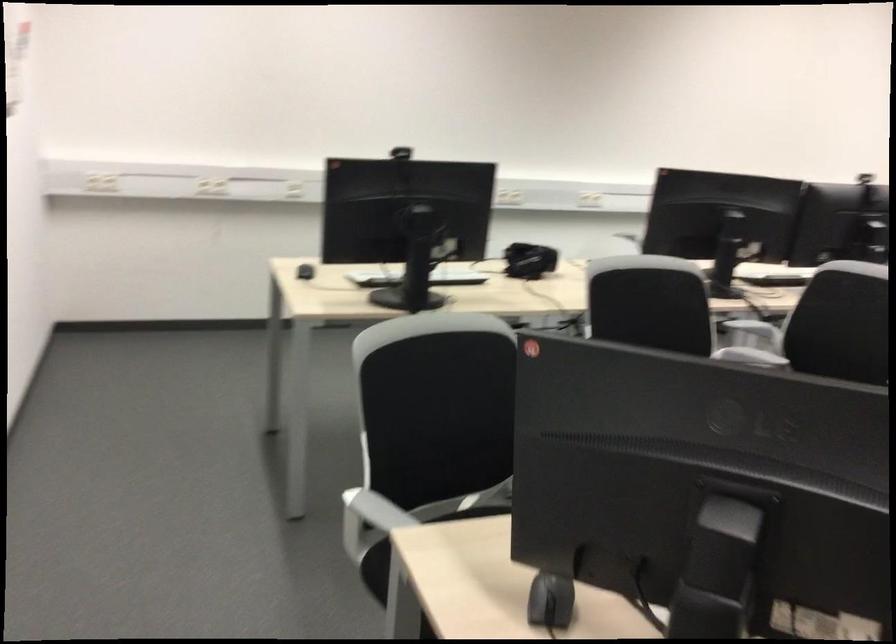
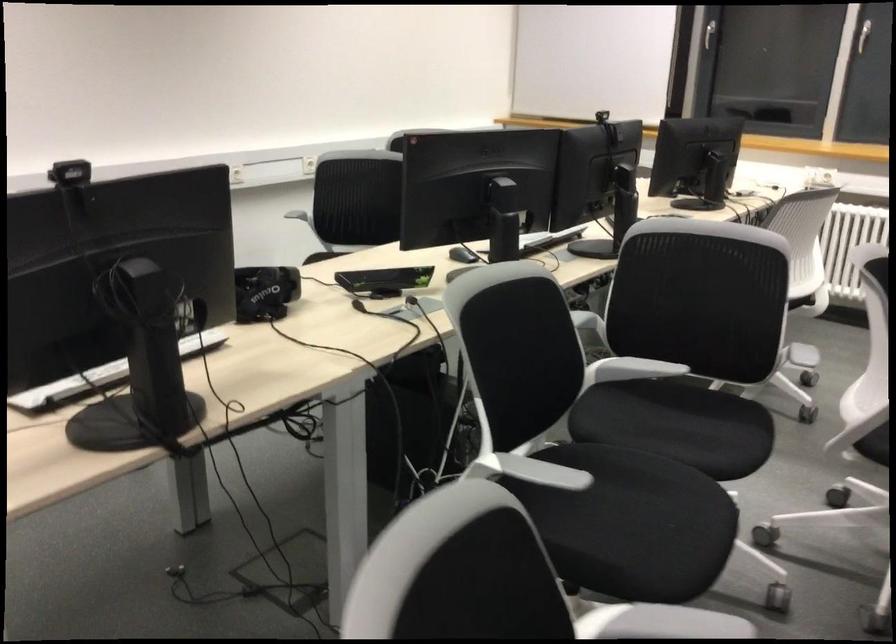
The point at [533,252] is marked in the first image. Where is the corresponding point in the second image?

(264, 292)